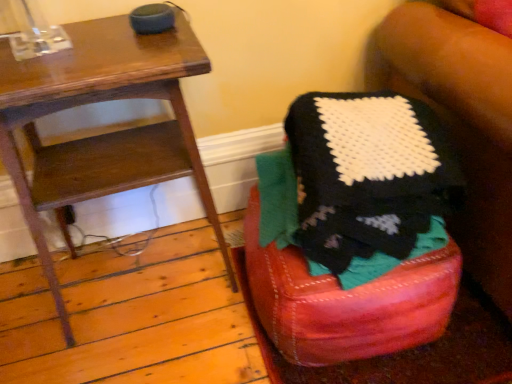
Question: From the image's perspective, is wooden side table at left above or below knitted fabric stool at lower right?

Choices:
 (A) below
 (B) above

Answer: (B)

Question: Which is correct: wooden side table at left is inside knitted fabric stool at lower right, or outside of it?

Choices:
 (A) inside
 (B) outside

Answer: (B)

Question: In terms of size, does wooden side table at left appear bigger or smaller than knitted fabric stool at lower right?

Choices:
 (A) small
 (B) big

Answer: (B)

Question: In the image, is knitted fabric stool at lower right positioned in front of or behind wooden side table at left?

Choices:
 (A) front
 (B) behind

Answer: (B)

Question: From a real-world perspective, is knitted fabric stool at lower right positioned above or below wooden side table at left?

Choices:
 (A) below
 (B) above

Answer: (A)

Question: Do you think knitted fabric stool at lower right is within wooden side table at left, or outside of it?

Choices:
 (A) outside
 (B) inside

Answer: (A)

Question: In terms of width, does knitted fabric stool at lower right look wider or thinner when compared to wooden side table at left?

Choices:
 (A) thin
 (B) wide

Answer: (B)